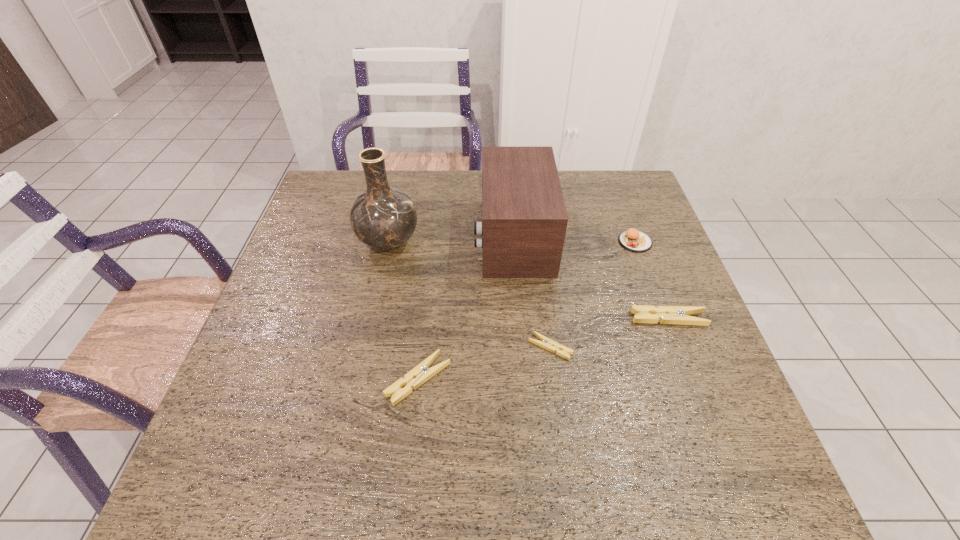
The width and height of the screenshot is (960, 540). I want to click on patty present at the right edge, so click(633, 240).

The image size is (960, 540). What are the coordinates of `vacant area at the far edge` in the screenshot? It's located at click(458, 190).

Locate an element on the screen. Image resolution: width=960 pixels, height=540 pixels. free space at the near edge of the desktop is located at coordinates (319, 404).

The image size is (960, 540). In the image, there is a desktop. In order to click on free space at the left edge in this screenshot , I will do `click(302, 227)`.

Where is `vacant area at the right edge`? This screenshot has width=960, height=540. vacant area at the right edge is located at coordinates (656, 225).

This screenshot has width=960, height=540. I want to click on vacant position at the far right corner of the desktop, so click(x=620, y=174).

Where is `free space at the near right corner of the desktop`? free space at the near right corner of the desktop is located at coordinates click(x=724, y=399).

Find the location of a particular element. Image resolution: width=960 pixels, height=540 pixels. vacant area that lies between the shortest object and the radio receiver is located at coordinates (532, 292).

Locate an element on the screen. Image resolution: width=960 pixels, height=540 pixels. free space between the vase and the shortest clothespin is located at coordinates (469, 295).

At what (x,y) coordinates should I click in order to perform the action: click on vacant space that is in between the fifth tallest object and the rightmost clothespin. Please return your answer as a coordinate pair (x, y). The height and width of the screenshot is (540, 960). Looking at the image, I should click on (543, 349).